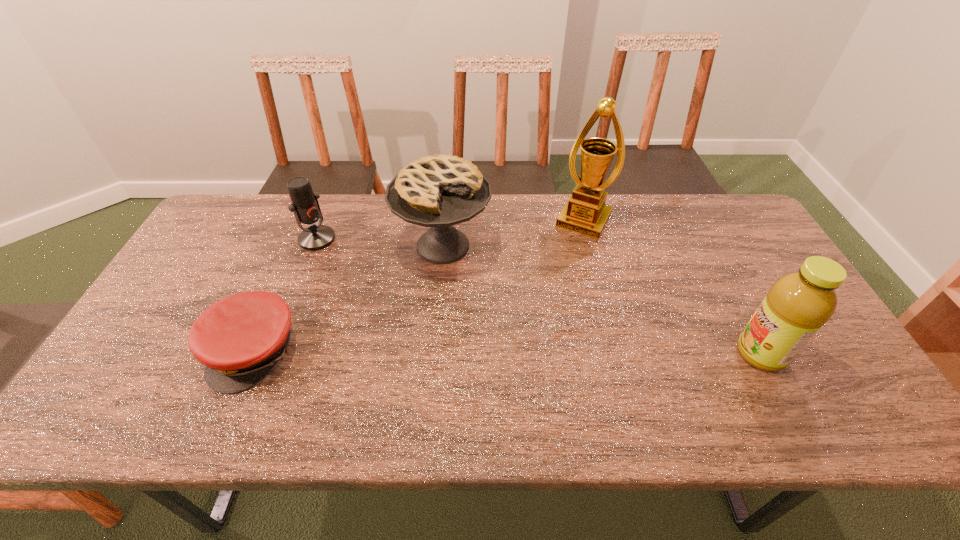
Locate an element on the screen. free space located on the front-facing side of the fourth object from left to right is located at coordinates (532, 315).

Where is `vacant space located on the front-facing side of the fourth object from left to right`? The image size is (960, 540). vacant space located on the front-facing side of the fourth object from left to right is located at coordinates (533, 312).

You are a GUI agent. You are given a task and a screenshot of the screen. Output one action in this format:
    pyautogui.click(x=<x>, y=<y>)
    Task: Click on the vacant space located 0.080m on the cut side of the pie
    
    Given the screenshot: What is the action you would take?
    pyautogui.click(x=458, y=300)

Find the location of a particular element. The height and width of the screenshot is (540, 960). vacant space located on the cut side of the pie is located at coordinates (481, 386).

Where is `vacant region located on the cut side of the pie`? vacant region located on the cut side of the pie is located at coordinates (464, 322).

Where is `vacant space located on the side of the microphone with the red ring`? The width and height of the screenshot is (960, 540). vacant space located on the side of the microphone with the red ring is located at coordinates (398, 301).

The width and height of the screenshot is (960, 540). Find the location of `vacant area situated on the side of the microphone with the red ring`. vacant area situated on the side of the microphone with the red ring is located at coordinates (387, 292).

Where is `vacant space situated on the side of the microphone with the red ring`? This screenshot has height=540, width=960. vacant space situated on the side of the microphone with the red ring is located at coordinates (384, 291).

At what (x,y) coordinates should I click in order to perform the action: click on award that is positioned at the far edge. Please return your answer as a coordinate pair (x, y). The image size is (960, 540). Looking at the image, I should click on (585, 212).

The image size is (960, 540). What are the coordinates of `pie that is positioned at the far edge` in the screenshot? It's located at (439, 191).